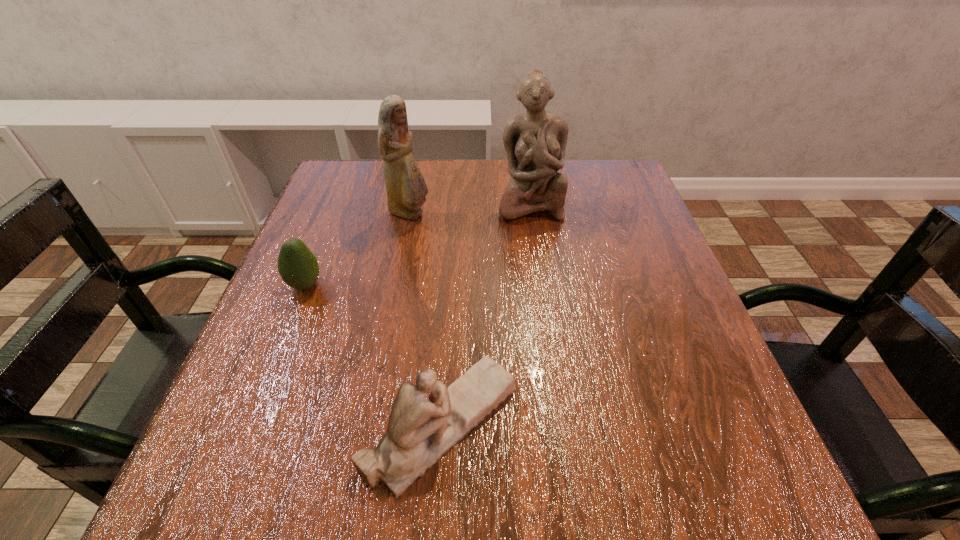
Identify the location of the nearest object. (427, 420).

Identify the location of the nearest figurine. This screenshot has width=960, height=540. (427, 420).

Identify the location of avocado. The image size is (960, 540). (298, 267).

Locate an element on the screen. The height and width of the screenshot is (540, 960). the shortest object is located at coordinates (298, 267).

I want to click on vacant space situated on the front-facing side of the shortest figurine, so click(x=626, y=424).

Identify the location of vacant region located 0.280m on the front of the second nearest object. (245, 436).

You are a GUI agent. You are given a task and a screenshot of the screen. Output one action in this format:
    pyautogui.click(x=<x>, y=<y>)
    Task: Click on the object present at the near edge
    The height and width of the screenshot is (540, 960).
    Given the screenshot: What is the action you would take?
    pyautogui.click(x=427, y=420)

The width and height of the screenshot is (960, 540). In order to click on object present at the left edge in this screenshot , I will do `click(298, 267)`.

Where is `vacant space at the far edge of the desktop`? This screenshot has width=960, height=540. vacant space at the far edge of the desktop is located at coordinates (491, 164).

I want to click on free space at the near edge of the desktop, so click(x=453, y=470).